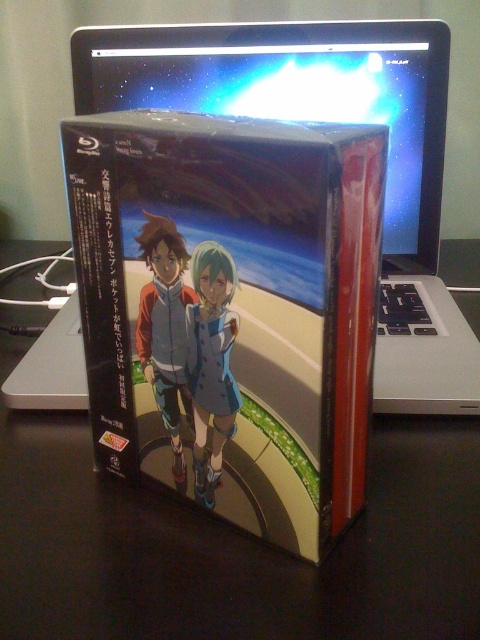
Is black matte table at center below silver metallic laptop at upper center?

Yes, black matte table at center is below silver metallic laptop at upper center.

Is black matte table at center shorter than silver metallic laptop at upper center?

Yes.

Is point (420, 458) positioned in front of point (238, 22)?

Yes.

Locate an element on the screen. black matte table at center is located at coordinates (236, 547).